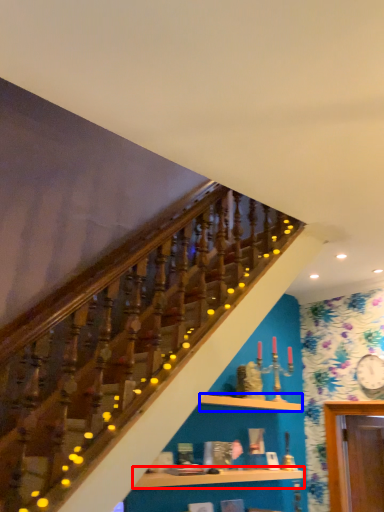
Question: Which point is closer to the camera, shelf (highlighted by a red box) or shelf (highlighted by a blue box)?

Choices:
 (A) shelf
 (B) shelf

Answer: (A)